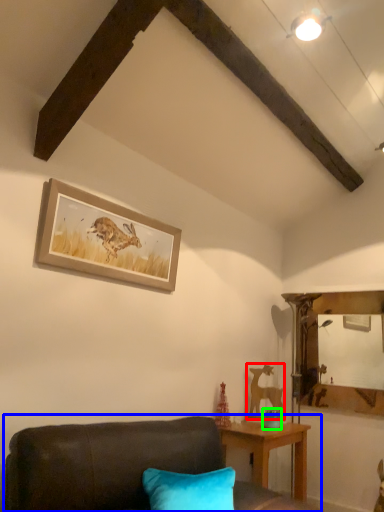
Question: Which object is positioned closest to animal (highlighted by a red box)? Select from studio couch (highlighted by a blue box) and teal (highlighted by a green box).

Choices:
 (A) studio couch
 (B) teal

Answer: (B)